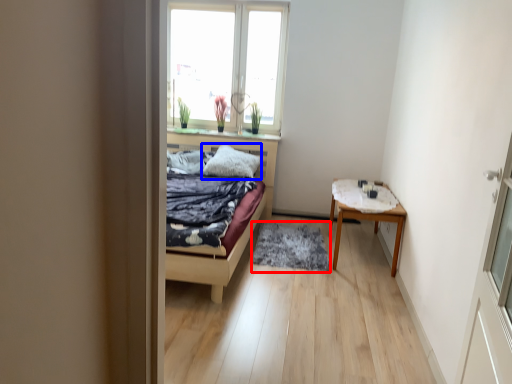
Question: Which point is closer to the camera, mat (highlighted by a red box) or pillow (highlighted by a blue box)?

Choices:
 (A) mat
 (B) pillow

Answer: (A)